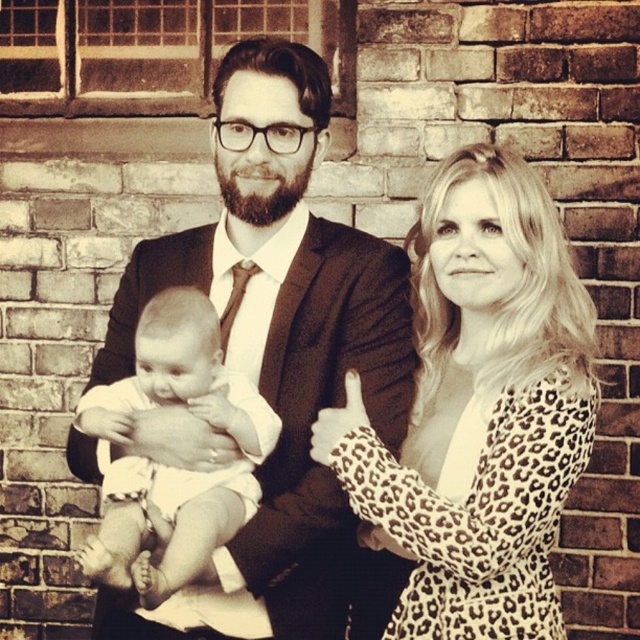
Question: Does black suit at center have a smaller size compared to white clothed baby at center?

Choices:
 (A) yes
 (B) no

Answer: (B)

Question: Which object is positioned closest to the leopard print dress at center?

Choices:
 (A) black suit at center
 (B) white clothed baby at center

Answer: (A)

Question: Among these objects, which one is nearest to the camera?

Choices:
 (A) black suit at center
 (B) leopard print dress at center

Answer: (B)

Question: Can you confirm if black suit at center is wider than white clothed baby at center?

Choices:
 (A) no
 (B) yes

Answer: (B)

Question: Does black suit at center lie behind white clothed baby at center?

Choices:
 (A) yes
 (B) no

Answer: (A)

Question: Among these points, which one is nearest to the camera?

Choices:
 (A) (164, 300)
 (B) (332, 557)
 (C) (480, 436)

Answer: (C)